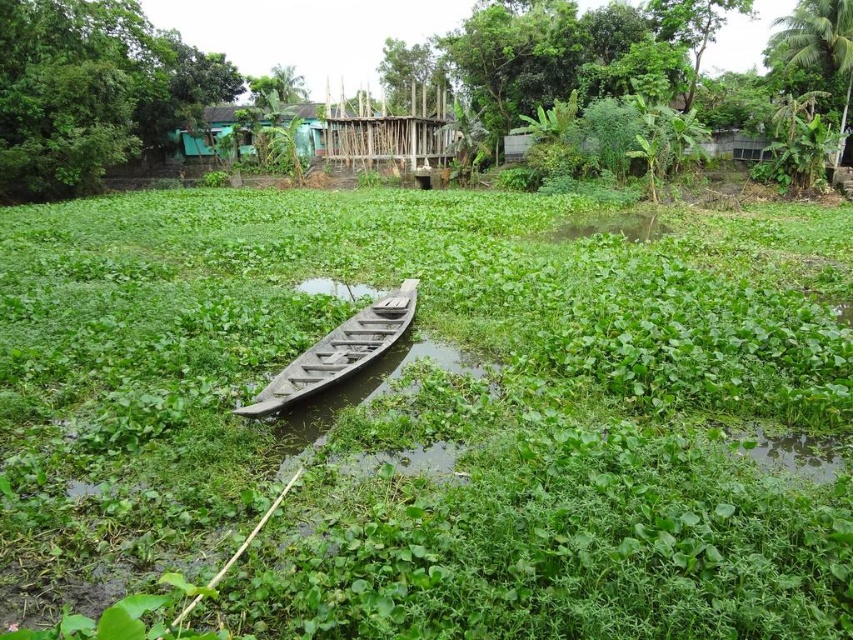
Locate an element on the screen. green matte grass at center is located at coordinates (433, 413).

Can you confirm if green matte grass at center is positioned below green leafy plants at center?

Correct, green matte grass at center is located below green leafy plants at center.

I want to click on green matte grass at center, so click(x=433, y=413).

Is green matte grass at center in front of wooden canoe at center?

Yes, green matte grass at center is closer to the viewer.

Is green matte grass at center wider than wooden canoe at center?

Indeed, green matte grass at center has a greater width compared to wooden canoe at center.

Does point (102, 524) come behind point (320, 378)?

No, it is in front of (320, 378).

This screenshot has height=640, width=853. Identify the location of green matte grass at center. (433, 413).

Who is shorter, green leafy plants at center or wooden canoe at center?

Standing shorter between the two is wooden canoe at center.

Is green leafy plants at center shorter than wooden canoe at center?

No, green leafy plants at center is not shorter than wooden canoe at center.

Between point (480, 24) and point (320, 364), which one is positioned in front?

Point (320, 364) is in front.

Identify the location of green leafy plants at center. The height and width of the screenshot is (640, 853). point(598,68).